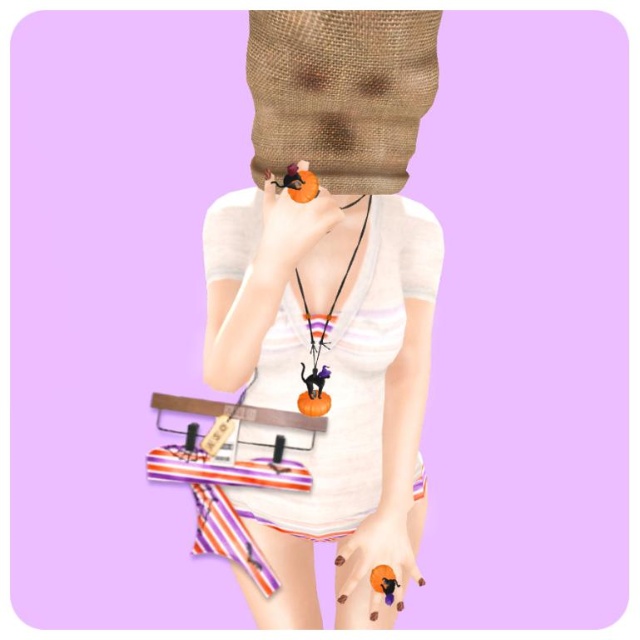
You are taking a photo of the person in the image. You notice two points marked as point (257, 90) and point (332, 308). Which point is closer to your camera lens?

Point (257, 90) is closer to the camera than point (332, 308).

You are an observer looking at the image. You notice the matte white shirt at center and the matte black cat at center. Which object is positioned more to the left?

The matte black cat at center is positioned more to the left than the matte white shirt at center.

From the picture: You are trying to determine the spatial relationship between the matte white shirt at center and the matte orange ring at lower center. Which object is wider?

The matte white shirt at center is wider than the matte orange ring at lower center.